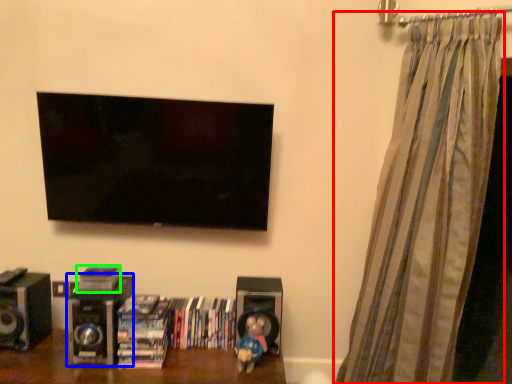
Question: Considering the real-world distances, which object is farthest from curtain (highlighted by a red box)? speaker (highlighted by a blue box) or book (highlighted by a green box)?

Choices:
 (A) speaker
 (B) book

Answer: (B)